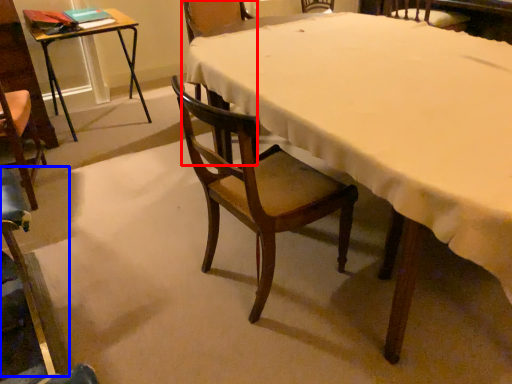
Question: Which of the following is the farthest to the observer, chair (highlighted by a red box) or chair (highlighted by a blue box)?

Choices:
 (A) chair
 (B) chair

Answer: (A)